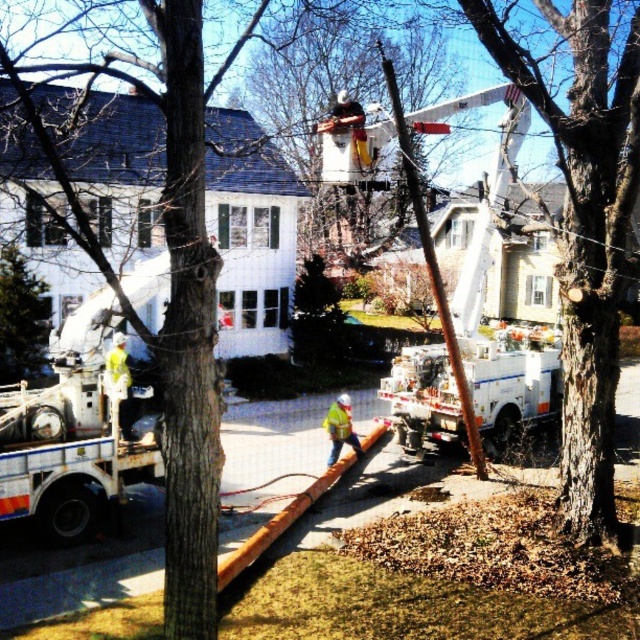
Can you confirm if white metallic utility truck at left is wider than yellow reflective safety vest at center?

Yes.

Which is more to the right, white metallic utility truck at left or yellow reflective safety vest at center?

Positioned to the right is yellow reflective safety vest at center.

At what (x,y) coordinates should I click in order to perform the action: click on white metallic utility truck at left. Please return your answer as a coordinate pair (x, y). Looking at the image, I should click on (72, 436).